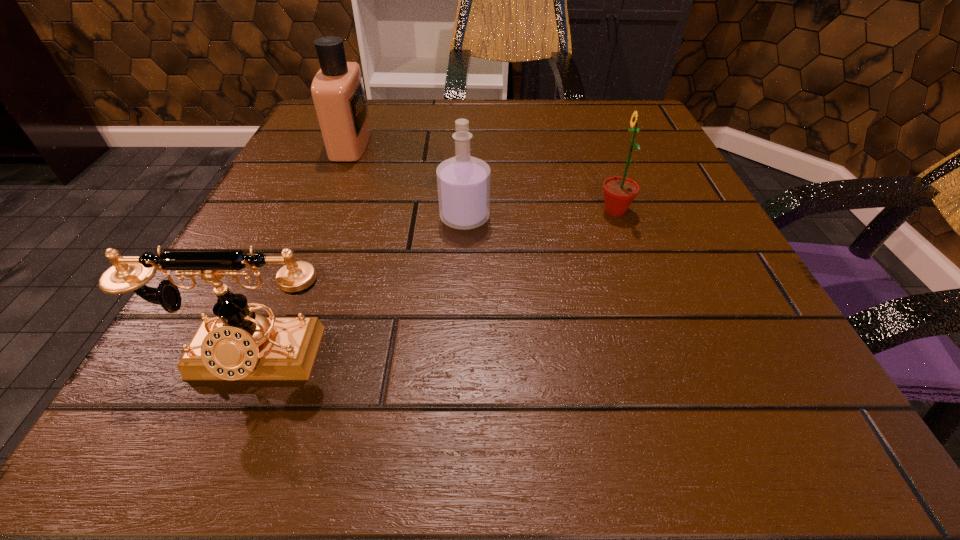
Locate an element on the screen. The height and width of the screenshot is (540, 960). the farther perfume is located at coordinates (337, 89).

Image resolution: width=960 pixels, height=540 pixels. I want to click on the farthest object, so click(x=337, y=89).

Locate an element on the screen. This screenshot has width=960, height=540. the rightmost object is located at coordinates (619, 192).

This screenshot has width=960, height=540. What are the coordinates of `the shorter perfume` in the screenshot? It's located at (463, 181).

In order to click on the nearer perfume in this screenshot , I will do `click(463, 181)`.

What are the coordinates of `telephone` in the screenshot? It's located at (237, 344).

Locate an element on the screen. The width and height of the screenshot is (960, 540). free point located on the front label of the farther perfume is located at coordinates (461, 144).

Locate an element on the screen. Image resolution: width=960 pixels, height=540 pixels. free space located 0.100m on the face of the rightmost object is located at coordinates (536, 211).

Locate an element on the screen. The image size is (960, 540). free space located on the face of the rightmost object is located at coordinates (405, 211).

The height and width of the screenshot is (540, 960). Find the location of `free space located 0.130m on the face of the rightmost object`. free space located 0.130m on the face of the rightmost object is located at coordinates (517, 211).